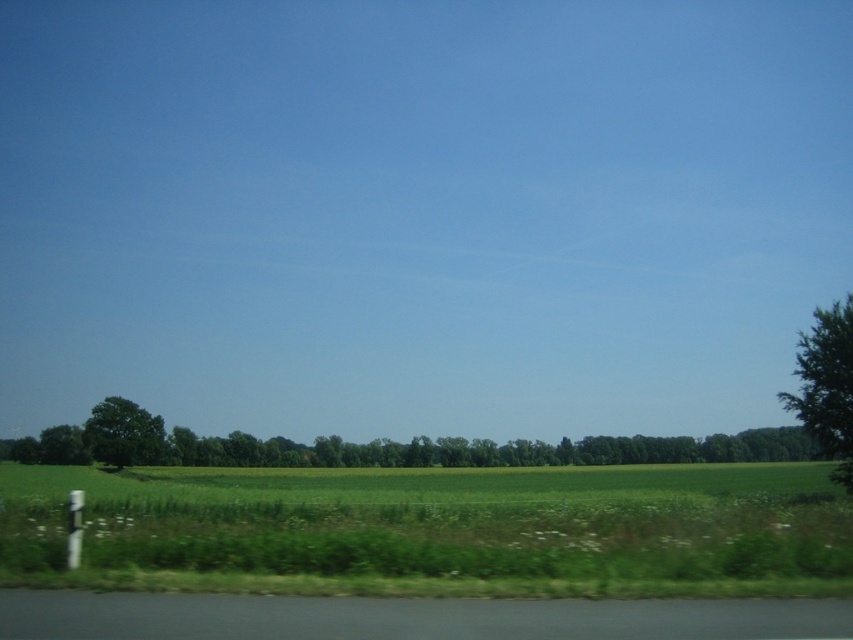
Measure the distance between green grass at lower center and green leafy tree at right.

107.01 feet

Between green grass at lower center and green leafy tree at right, which one is positioned higher?

green leafy tree at right is higher up.

I want to click on green grass at lower center, so click(x=436, y=529).

Image resolution: width=853 pixels, height=640 pixels. In order to click on green grass at lower center in this screenshot , I will do `click(436, 529)`.

Can you confirm if green grass at lower center is smaller than green leafy tree at lower left?

No, green grass at lower center is not smaller than green leafy tree at lower left.

Is green grass at lower center wider than green leafy tree at lower left?

Correct, the width of green grass at lower center exceeds that of green leafy tree at lower left.

Measure the distance between point (x=379, y=486) and camera.

Point (x=379, y=486) is 232.11 feet away from camera.

You are a GUI agent. You are given a task and a screenshot of the screen. Output one action in this format:
    pyautogui.click(x=<x>, y=<y>)
    Task: Click on the green grass at lower center
    The width and height of the screenshot is (853, 640).
    Given the screenshot: What is the action you would take?
    pyautogui.click(x=436, y=529)

Between green leafy tree at right and green leafy tree at lower left, which one appears on the right side from the viewer's perspective?

green leafy tree at right

Is green leafy tree at right closer to camera compared to green leafy tree at lower left?

Yes, green leafy tree at right is in front of green leafy tree at lower left.

The image size is (853, 640). Identify the location of green leafy tree at right. (827, 385).